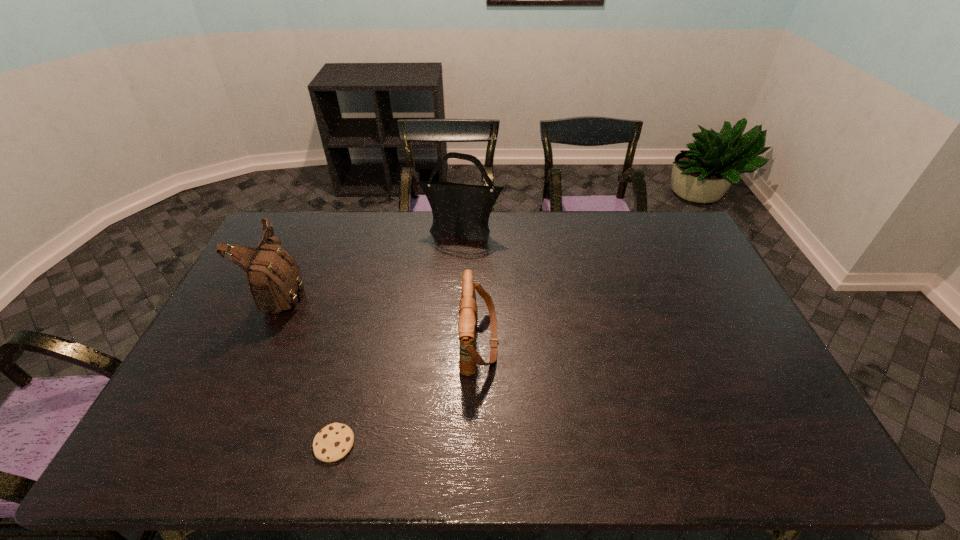
Identify the location of vacant area that lies between the second shortest shoulder bag and the third tallest object. The width and height of the screenshot is (960, 540). (382, 316).

Where is `vacant space in between the cookie and the leftmost shoulder bag`? The height and width of the screenshot is (540, 960). vacant space in between the cookie and the leftmost shoulder bag is located at coordinates (309, 368).

What are the coordinates of `free spot between the second tallest object and the second shortest object` in the screenshot? It's located at (x=382, y=316).

I want to click on empty location between the shortest shoulder bag and the third shortest object, so click(382, 316).

Where is `vacant area that lies between the second shortest object and the cookie`? vacant area that lies between the second shortest object and the cookie is located at coordinates (407, 393).

This screenshot has height=540, width=960. Find the location of `free spot between the leftmost shoulder bag and the second shortest object`. free spot between the leftmost shoulder bag and the second shortest object is located at coordinates (382, 316).

Identify the location of vacant area that lies between the nearest object and the shortest shoulder bag. The height and width of the screenshot is (540, 960). (407, 393).

Identify which object is the closest to the third object from right to left. Please provide its 2D coordinates. Your answer should be formatted as a tuple, i.e. [(x, y)], where the tuple contains the x and y coordinates of a point satisfying the conditions above.

[(468, 311)]

The width and height of the screenshot is (960, 540). I want to click on object identified as the closest to the leftmost object, so click(x=460, y=209).

Identify which shoulder bag is the second nearest to the nearest object. Please provide its 2D coordinates. Your answer should be formatted as a tuple, i.e. [(x, y)], where the tuple contains the x and y coordinates of a point satisfying the conditions above.

[(274, 279)]